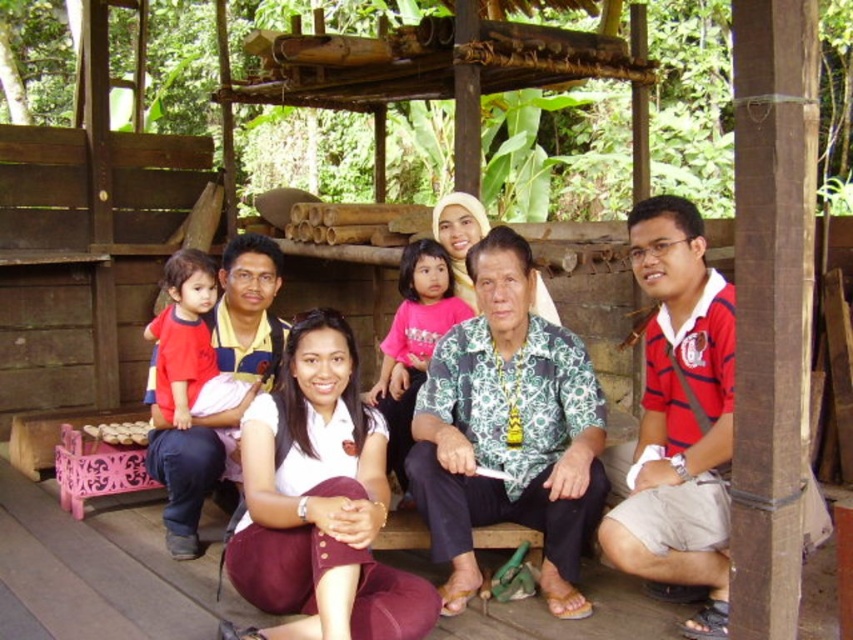
Who is higher up, white matte shirt at center or pink fabric shirt at center?

pink fabric shirt at center is above.

Is white matte shirt at center positioned at the back of pink fabric shirt at center?

No, it is in front of pink fabric shirt at center.

Identify the location of white matte shirt at center. This screenshot has width=853, height=640. (318, 500).

The width and height of the screenshot is (853, 640). Describe the element at coordinates (593, 426) in the screenshot. I see `white shirt at center` at that location.

Who is lower down, white shirt at center or pink fabric shirt at center?

white shirt at center is lower down.

Is point (434, 541) closer to camera compared to point (410, 257)?

Yes, point (434, 541) is in front of point (410, 257).

Image resolution: width=853 pixels, height=640 pixels. I want to click on white shirt at center, so click(x=593, y=426).

Is white shirt at center above red cotton shirt at left?

Yes, white shirt at center is above red cotton shirt at left.

Is point (689, 284) positioned before point (169, 259)?

Yes.

Between point (718, 371) and point (172, 470), which one is positioned behind?

The point (172, 470) is behind.

Locate an element on the screen. The width and height of the screenshot is (853, 640). white shirt at center is located at coordinates 593,426.